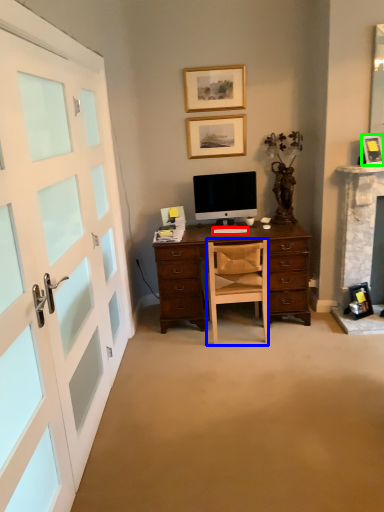
Question: Based on their relative distances, which object is farther from computer keyboard (highlighted by a red box)? Choose from chair (highlighted by a blue box) and picture frame (highlighted by a green box).

Choices:
 (A) chair
 (B) picture frame

Answer: (B)